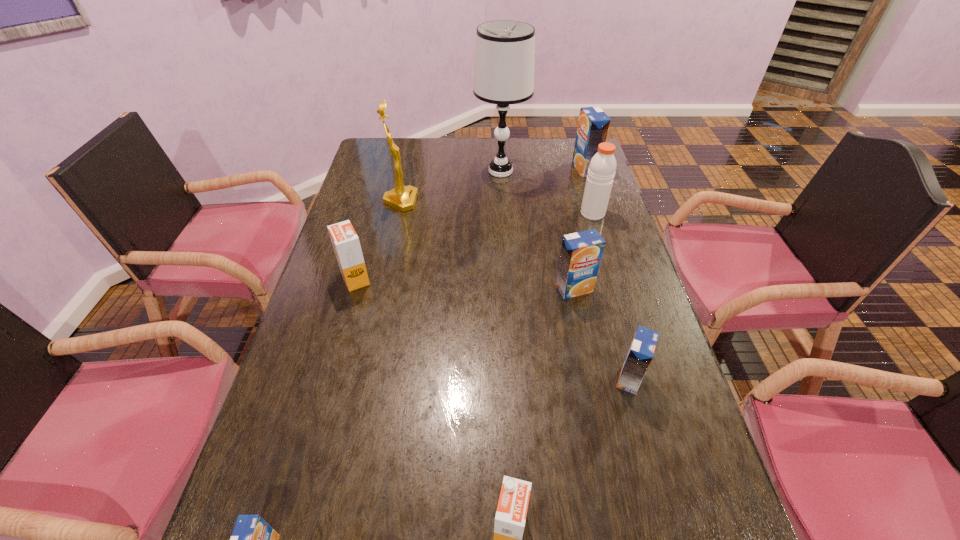
Identify the location of empty location between the award and the biggest blue orange_juice. (492, 185).

The height and width of the screenshot is (540, 960). I want to click on blank region between the left orange orange juice and the seventh farthest object, so click(492, 329).

Locate an element on the screen. free spot between the white table lamp and the third nearest blue orange_juice is located at coordinates click(538, 230).

What are the coordinates of `unoccupied position between the tallest orange_juice and the golden award` in the screenshot? It's located at (492, 185).

Find the location of a particular element. free space between the third farthest blue orange_juice and the tallest orange_juice is located at coordinates (608, 274).

Find the location of a particular element. object that is the sixth closest to the third nearest orange_juice is located at coordinates (505, 49).

Find the location of a particular element. object that is the closest to the shortest orange_juice is located at coordinates (510, 518).

Choose which orange_juice is the third nearest neighbor to the golden award. Please provide its 2D coordinates. Your answer should be formatted as a tuple, i.e. [(x, y)], where the tuple contains the x and y coordinates of a point satisfying the conditions above.

[(593, 125)]

What are the coordinates of `orange_juice that is the fourth closest to the third smallest blue orange_juice` in the screenshot? It's located at (510, 518).

Locate which blue orange_juice is the closest to the leftmost blue orange_juice. Please provide its 2D coordinates. Your answer should be formatted as a tuple, i.e. [(x, y)], where the tuple contains the x and y coordinates of a point satisfying the conditions above.

[(640, 354)]